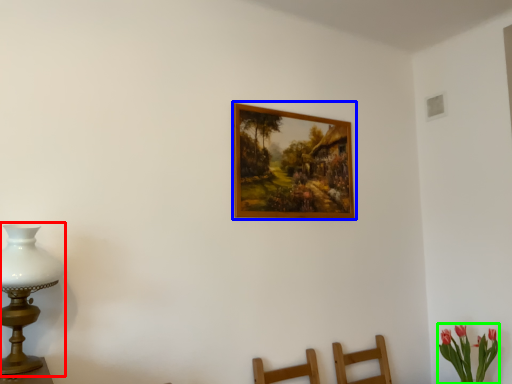
Question: Considering the real-world distances, which object is farthest from table lamp (highlighted by a red box)? picture frame (highlighted by a blue box) or floral arrangement (highlighted by a green box)?

Choices:
 (A) picture frame
 (B) floral arrangement

Answer: (B)